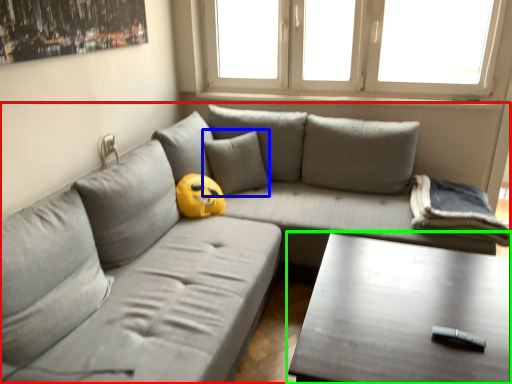
Question: Which object is the farthest from studio couch (highlighted by a red box)? Choose among these: pillow (highlighted by a blue box) or table (highlighted by a green box).

Choices:
 (A) pillow
 (B) table

Answer: (B)